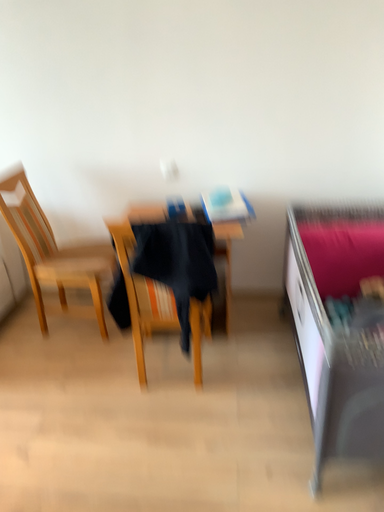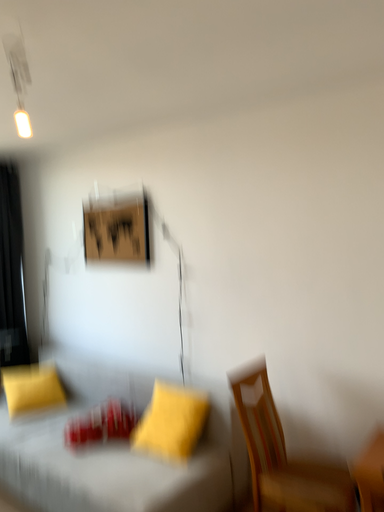
Question: Which way did the camera rotate in the video?

Choices:
 (A) rotated left
 (B) rotated right

Answer: (A)